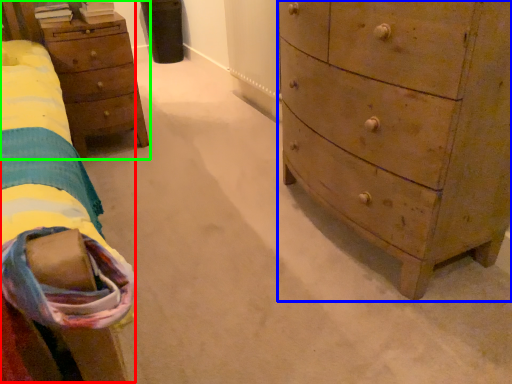
Question: Based on their relative distances, which object is nearer to bed (highlighted by a red box)? Choose from chest of drawers (highlighted by a blue box) and nightstand (highlighted by a green box).

Choices:
 (A) chest of drawers
 (B) nightstand

Answer: (B)